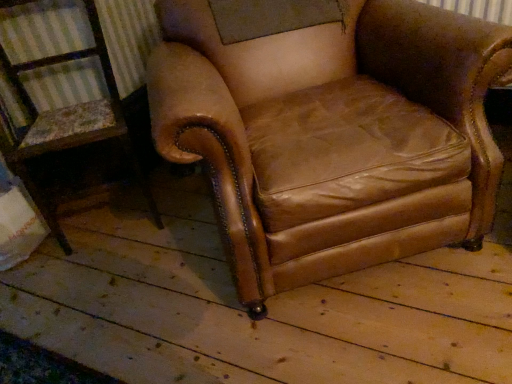
Question: Is the position of brown leather armchair at center, marked as the 1th chair in a right-to-left arrangement, more distant than that of brown leather armchair at center, which is the 2th chair in right-to-left order?

Choices:
 (A) yes
 (B) no

Answer: (B)

Question: Does brown leather armchair at center, which is counted as the second chair, starting from the left, lie in front of brown leather armchair at center, which is the 1th chair from left to right?

Choices:
 (A) no
 (B) yes

Answer: (B)

Question: Is brown leather armchair at center, which is the 1th chair from left to right, completely or partially inside brown leather armchair at center, which is counted as the second chair, starting from the left?

Choices:
 (A) yes
 (B) no

Answer: (B)

Question: Is brown leather armchair at center, marked as the 1th chair in a right-to-left arrangement, looking in the opposite direction of brown leather armchair at center, which is the 2th chair in right-to-left order?

Choices:
 (A) yes
 (B) no

Answer: (B)

Question: Considering the relative sizes of brown leather armchair at center, which is counted as the second chair, starting from the left, and brown leather armchair at center, which is the 2th chair in right-to-left order, in the image provided, is brown leather armchair at center, which is counted as the second chair, starting from the left, shorter than brown leather armchair at center, which is the 2th chair in right-to-left order,?

Choices:
 (A) yes
 (B) no

Answer: (B)

Question: Does brown leather armchair at center, which is counted as the second chair, starting from the left, have a greater height compared to brown leather armchair at center, which is the 1th chair from left to right?

Choices:
 (A) yes
 (B) no

Answer: (A)

Question: Is brown leather armchair at center, which is the 1th chair from left to right, taller than brown leather armchair at center, which is counted as the second chair, starting from the left?

Choices:
 (A) no
 (B) yes

Answer: (A)

Question: Is brown leather armchair at center, which is the 2th chair in right-to-left order, positioned beyond the bounds of brown leather armchair at center, marked as the 1th chair in a right-to-left arrangement?

Choices:
 (A) no
 (B) yes

Answer: (B)

Question: Is brown leather armchair at center, which is the 1th chair from left to right, oriented towards brown leather armchair at center, marked as the 1th chair in a right-to-left arrangement?

Choices:
 (A) yes
 (B) no

Answer: (B)

Question: Is brown leather armchair at center, which is the 2th chair in right-to-left order, positioned behind brown leather armchair at center, which is counted as the second chair, starting from the left?

Choices:
 (A) no
 (B) yes

Answer: (B)

Question: Is brown leather armchair at center, which is the 1th chair from left to right, shorter than brown leather armchair at center, marked as the 1th chair in a right-to-left arrangement?

Choices:
 (A) no
 (B) yes

Answer: (B)

Question: Is brown leather armchair at center, which is counted as the second chair, starting from the left, surrounded by brown leather armchair at center, which is the 2th chair in right-to-left order?

Choices:
 (A) yes
 (B) no

Answer: (B)

Question: Considering the positions of point (441, 210) and point (26, 64), is point (441, 210) closer or farther from the camera than point (26, 64)?

Choices:
 (A) farther
 (B) closer

Answer: (B)